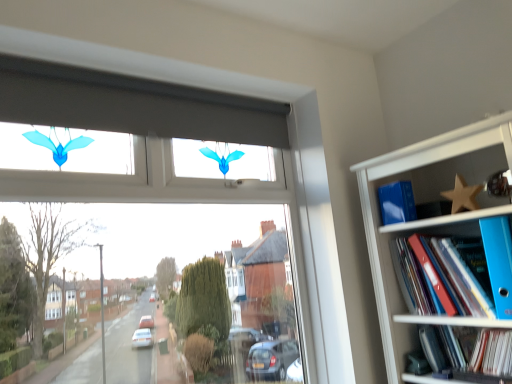
This screenshot has width=512, height=384. What do you see at coordinates (499, 262) in the screenshot?
I see `blue plastic folder at right, placed as the first paperback book when sorted from right to left` at bounding box center [499, 262].

Where is `blue plastic folder at lower right, which is counted as the 2th book, starting from the top`? Image resolution: width=512 pixels, height=384 pixels. blue plastic folder at lower right, which is counted as the 2th book, starting from the top is located at coordinates (490, 355).

Describe the element at coordinates (397, 202) in the screenshot. I see `blue matte book at upper right, the second paperback book in the right-to-left sequence` at that location.

You are a GUI agent. You are given a task and a screenshot of the screen. Output one action in this format:
    pyautogui.click(x=<x>, y=<y>)
    Task: Click on the blue matte book at upper right, which ranks as the 2th paperback book in front-to-back order
    Image resolution: width=512 pixels, height=384 pixels.
    Given the screenshot: What is the action you would take?
    pyautogui.click(x=397, y=202)

What is the approximate width of wooden star at upper right?

wooden star at upper right is 1.90 inches wide.

Image resolution: width=512 pixels, height=384 pixels. I want to click on blue plastic folders at upper right, so click(x=428, y=218).

From a real-world perspective, is blue plastic folder at right, the 2th book in the bottom-to-top sequence, above or below blue matte book at upper right, which ranks as the 2th paperback book in front-to-back order?

From a real-world perspective, blue plastic folder at right, the 2th book in the bottom-to-top sequence, is physically below blue matte book at upper right, which ranks as the 2th paperback book in front-to-back order.

Is blue plastic folder at right, acting as the 1th book starting from the top, wider than blue matte book at upper right, which appears as the 1th paperback book when viewed from the left?

Correct, the width of blue plastic folder at right, acting as the 1th book starting from the top, exceeds that of blue matte book at upper right, which appears as the 1th paperback book when viewed from the left.

Between blue plastic folder at right, the 2th book in the bottom-to-top sequence, and blue matte book at upper right, the second paperback book in the right-to-left sequence, which one appears on the right side from the viewer's perspective?

From the viewer's perspective, blue plastic folder at right, the 2th book in the bottom-to-top sequence, appears more on the right side.

Between blue plastic folder at right, the 2th book in the bottom-to-top sequence, and blue matte book at upper right, which appears as the 1th paperback book when viewed from the left, which one has more height?

Standing taller between the two is blue plastic folder at right, the 2th book in the bottom-to-top sequence.

From a real-world perspective, is blue plastic folder at right, placed as the first paperback book when sorted from right to left, positioned above or below blue matte book at upper right, placed as the 1th paperback book when sorted from back to front?

Clearly, from a real-world perspective, blue plastic folder at right, placed as the first paperback book when sorted from right to left, is below blue matte book at upper right, placed as the 1th paperback book when sorted from back to front.

Are blue plastic folder at right, placed as the 2th paperback book when sorted from back to front, and blue matte book at upper right, which ranks as the 2th paperback book in front-to-back order, far apart?

No.

Is point (494, 242) closer or farther from the camera than point (398, 199)?

Clearly, point (494, 242) is closer to the camera than point (398, 199).

Identify the location of paperback book that is under the blue matte book at upper right, which ranks as the 2th paperback book in front-to-back order (from a real-world perspective). (499, 262).

Is point (479, 144) closer to camera compared to point (454, 211)?

Yes, point (479, 144) is closer to viewer.

Does blue plastic folders at upper right turn towards wooden star at upper right?

Yes, blue plastic folders at upper right is turned towards wooden star at upper right.

Is blue plastic folders at upper right far from wooden star at upper right?

That's not correct — blue plastic folders at upper right is a little close to wooden star at upper right.

In the image, is blue plastic folders at upper right on the left side or the right side of wooden star at upper right?

From the image, it's evident that blue plastic folders at upper right is to the right of wooden star at upper right.

Which object is further away from the camera taking this photo, blue matte book at upper right, which ranks as the 2th paperback book in front-to-back order, or blue plastic folder at right, the second paperback book viewed from the left?

blue matte book at upper right, which ranks as the 2th paperback book in front-to-back order, is further from the camera.

Where is `paperback book located behind the blue plastic folder at right, placed as the 2th paperback book when sorted from back to front`? paperback book located behind the blue plastic folder at right, placed as the 2th paperback book when sorted from back to front is located at coordinates (397, 202).

Can you confirm if blue matte book at upper right, placed as the 1th paperback book when sorted from back to front, is smaller than blue plastic folder at right, placed as the first paperback book when sorted from right to left?

Correct, blue matte book at upper right, placed as the 1th paperback book when sorted from back to front, occupies less space than blue plastic folder at right, placed as the first paperback book when sorted from right to left.

From a real-world perspective, is blue plastic folders at upper right positioned over blue plastic folder at right, positioned as the 1th paperback book in front-to-back order, based on gravity?

No, from a real-world perspective, blue plastic folders at upper right is not on top of blue plastic folder at right, positioned as the 1th paperback book in front-to-back order.

Which point is more forward, (460,150) or (504,220)?

The point (504,220) is more forward.

Between blue plastic folders at upper right and blue plastic folder at right, positioned as the 1th paperback book in front-to-back order, which one is positioned behind?

blue plastic folder at right, positioned as the 1th paperback book in front-to-back order, is further from the camera.

In the scene shown: From the image's perspective, is blue plastic folders at upper right positioned above or below blue plastic folder at right, placed as the first paperback book when sorted from right to left?

Clearly, from the image's perspective, blue plastic folders at upper right is below blue plastic folder at right, placed as the first paperback book when sorted from right to left.

Considering the sizes of wooden star at upper right and blue plastic folders at upper right in the image, is wooden star at upper right wider or thinner than blue plastic folders at upper right?

Clearly, wooden star at upper right has less width compared to blue plastic folders at upper right.

How many degrees apart are the facing directions of wooden star at upper right and blue plastic folders at upper right?

wooden star at upper right and blue plastic folders at upper right are facing 2.4 degrees away from each other.

Between wooden star at upper right and blue plastic folders at upper right, which one appears on the left side from the viewer's perspective?

From the viewer's perspective, wooden star at upper right appears more on the left side.

Is wooden star at upper right oriented away from blue plastic folders at upper right?

Absolutely, wooden star at upper right is directed away from blue plastic folders at upper right.

Can you confirm if blue plastic folder at lower right, which is the 1th book in bottom-to-top order, is positioned to the right of blue matte book at upper right, placed as the 1th paperback book when sorted from back to front?

Yes, blue plastic folder at lower right, which is the 1th book in bottom-to-top order, is to the right of blue matte book at upper right, placed as the 1th paperback book when sorted from back to front.

The height and width of the screenshot is (384, 512). What are the coordinates of `paperback book that is the 2nd one when counting upward from the blue plastic folder at lower right, which is the 1th book in bottom-to-top order (from the image's perspective)` in the screenshot? It's located at (397, 202).

From a real-world perspective, is blue plastic folder at lower right, which is counted as the 2th book, starting from the top, located higher than blue matte book at upper right, which appears as the 1th paperback book when viewed from the left?

No, from a real-world perspective, blue plastic folder at lower right, which is counted as the 2th book, starting from the top, is not on top of blue matte book at upper right, which appears as the 1th paperback book when viewed from the left.

Is blue plastic folder at lower right, which is the 1th book in bottom-to-top order, in contact with blue matte book at upper right, the second paperback book in the right-to-left sequence?

blue plastic folder at lower right, which is the 1th book in bottom-to-top order, and blue matte book at upper right, the second paperback book in the right-to-left sequence, are clearly separated.

From the image's perspective, which paperback book is the 2nd one above the blue plastic folder at right, the 2th book in the bottom-to-top sequence? Please provide its 2D coordinates.

[(397, 202)]

Find the location of a particular element. The image size is (512, 384). paperback book below the blue matte book at upper right, which ranks as the 2th paperback book in front-to-back order (from the image's perspective) is located at coordinates (499, 262).

Looking at the image, which one is located closer to blue plastic folder at lower right, which is counted as the 2th book, starting from the top, blue plastic folder at right, the 2th book in the bottom-to-top sequence, or blue matte book at upper right, which appears as the 1th paperback book when viewed from the left?

blue plastic folder at right, the 2th book in the bottom-to-top sequence.

Considering their positions, is blue plastic folders at upper right positioned closer to blue matte book at upper right, placed as the 1th paperback book when sorted from back to front, than blue plastic folder at lower right, which is counted as the 2th book, starting from the top?

blue plastic folders at upper right lies closer to blue matte book at upper right, placed as the 1th paperback book when sorted from back to front, than the other object.

When comparing their distances from blue plastic folder at right, acting as the 1th book starting from the top, does blue plastic folder at lower right, which is the 1th book in bottom-to-top order, or blue plastic folders at upper right seem closer?

Among the two, blue plastic folders at upper right is located nearer to blue plastic folder at right, acting as the 1th book starting from the top.

From the image, which object appears to be farther from blue plastic folder at right, the 2th book in the bottom-to-top sequence, blue matte book at upper right, the second paperback book in the right-to-left sequence, or blue plastic folder at right, placed as the 2th paperback book when sorted from back to front?

Based on the image, blue matte book at upper right, the second paperback book in the right-to-left sequence, appears to be further to blue plastic folder at right, the 2th book in the bottom-to-top sequence.

Based on their spatial positions, is blue plastic folder at lower right, which is the 1th book in bottom-to-top order, or blue matte book at upper right, which ranks as the 2th paperback book in front-to-back order, closer to blue plastic folder at right, the second paperback book viewed from the left?

Among the two, blue plastic folder at lower right, which is the 1th book in bottom-to-top order, is located nearer to blue plastic folder at right, the second paperback book viewed from the left.

From the image, which object appears to be farther from wooden star at upper right, blue plastic folder at right, acting as the 1th book starting from the top, or blue plastic folder at right, positioned as the 1th paperback book in front-to-back order?

blue plastic folder at right, acting as the 1th book starting from the top, is positioned further to the anchor wooden star at upper right.

Which object lies further to the anchor point blue plastic folders at upper right, blue plastic folder at right, acting as the 1th book starting from the top, or blue plastic folder at lower right, which is counted as the 2th book, starting from the top?

blue plastic folder at lower right, which is counted as the 2th book, starting from the top, is positioned further to the anchor blue plastic folders at upper right.

Estimate the real-world distances between objects in this image. Which object is closer to wooden star at upper right, blue plastic folders at upper right or blue plastic folder at lower right, which is the 1th book in bottom-to-top order?

blue plastic folders at upper right.

Locate an element on the screen. paperback book between blue plastic folders at upper right and blue matte book at upper right, which ranks as the 2th paperback book in front-to-back order, along the z-axis is located at coordinates tap(499, 262).

This screenshot has width=512, height=384. I want to click on book between blue matte book at upper right, the second paperback book in the right-to-left sequence, and blue plastic folder at lower right, which is counted as the 2th book, starting from the top, from top to bottom, so click(x=442, y=278).

In order to click on paperback book between blue plastic folders at upper right and blue plastic folder at lower right, which is counted as the 2th book, starting from the top, from front to back in this screenshot , I will do (499, 262).

At what (x,y) coordinates should I click in order to perform the action: click on book located between blue plastic folders at upper right and blue plastic folder at lower right, which is the 1th book in bottom-to-top order, in the depth direction. Please return your answer as a coordinate pair (x, y). Looking at the image, I should click on (442, 278).